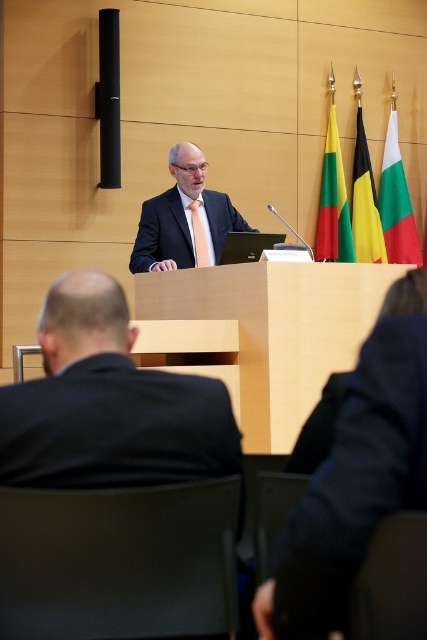
Question: Which object is farther from the camera taking this photo?

Choices:
 (A) black suit at lower left
 (B) white fabric flag at right
 (C) matte black suit at center

Answer: (B)

Question: Where is white fabric flag at right located in relation to matte black tie at center in the image?

Choices:
 (A) above
 (B) below

Answer: (A)

Question: Does matte black suit at center have a lesser width compared to yellow-green striped flag at center?

Choices:
 (A) yes
 (B) no

Answer: (B)

Question: Which point is closer to the camera?

Choices:
 (A) matte black suit at center
 (B) yellow-green-black-yellow-green-black-yellow-green flag at upper center

Answer: (A)

Question: Which point appears closest to the camera in this image?

Choices:
 (A) (383, 244)
 (B) (157, 422)
 (C) (330, 163)

Answer: (B)

Question: Is yellow-green striped flag at center closer to the viewer compared to matte black tie at center?

Choices:
 (A) yes
 (B) no

Answer: (B)